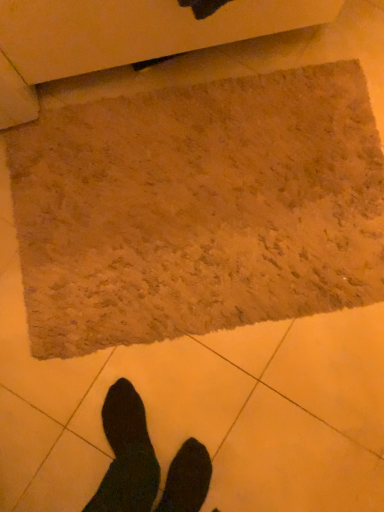
Find the location of a particular element. This screenshot has height=512, width=384. free space in front of beige shaggy rug at center is located at coordinates (205, 407).